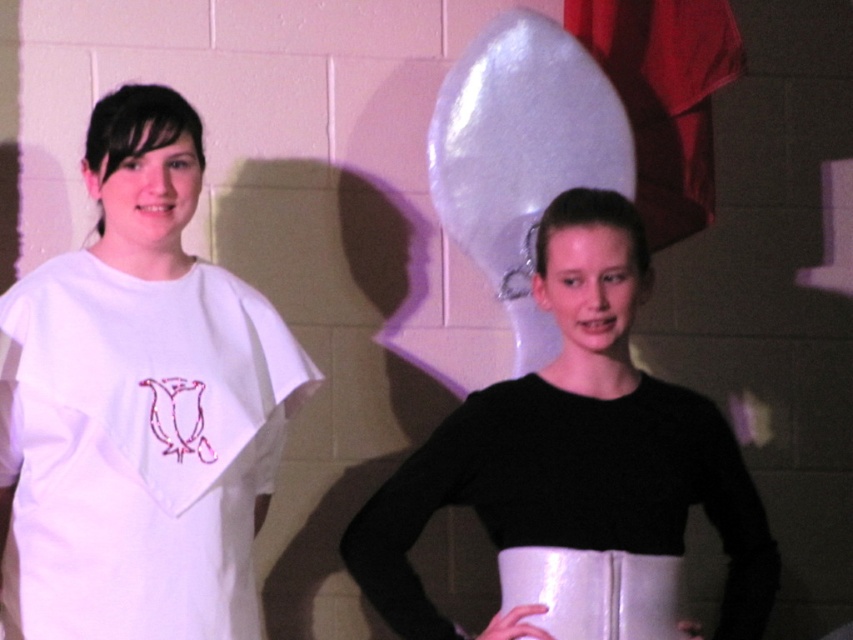
Question: Which point appears farthest from the camera in this image?

Choices:
 (A) (583, 289)
 (B) (521, 614)

Answer: (A)

Question: Can you confirm if white matte t-shirt at left is bigger than white glossy apron at lower center?

Choices:
 (A) yes
 (B) no

Answer: (A)

Question: Is white matte t-shirt at left further to the viewer compared to black matte sweater at center?

Choices:
 (A) no
 (B) yes

Answer: (B)

Question: Which of the following is the closest to the observer?

Choices:
 (A) (601, 596)
 (B) (412, 467)

Answer: (A)

Question: Which of these objects is positioned farthest from the black matte sweater at center?

Choices:
 (A) white glossy apron at lower center
 (B) white matte t-shirt at left

Answer: (B)

Question: Where is black matte sweater at center located in relation to white glossy apron at lower center in the image?

Choices:
 (A) left
 (B) right

Answer: (B)